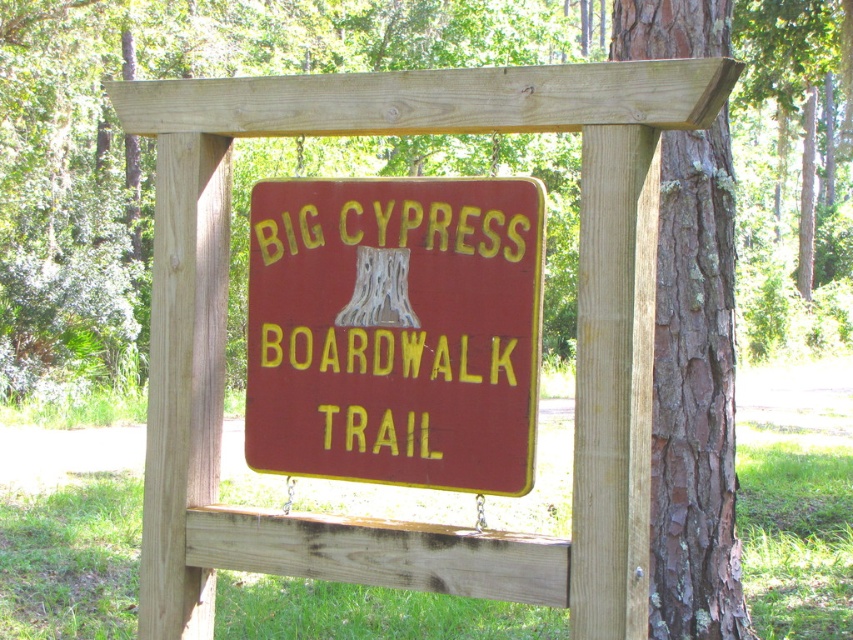
Who is positioned more to the left, brown rough bark tree at center or brown rough bark at right?

brown rough bark at right

Is point (140, 68) closer to viewer compared to point (683, 225)?

No, it is not.

You are a GUI agent. You are given a task and a screenshot of the screen. Output one action in this format:
    pyautogui.click(x=<x>, y=<y>)
    Task: Click on the brown rough bark tree at center
    
    Given the screenshot: What is the action you would take?
    pyautogui.click(x=151, y=140)

Is point (215, 33) behind point (252, 208)?

Yes.

Does brown rough bark tree at center appear over matte red sign at center?

Correct, brown rough bark tree at center is located above matte red sign at center.

Between point (140, 355) and point (447, 410), which one is positioned behind?

The point (140, 355) is behind.

The image size is (853, 640). Find the location of `brown rough bark tree at center`. brown rough bark tree at center is located at coordinates (151, 140).

Is matte red sign at center to the left of brown rough bark at right from the viewer's perspective?

Yes, matte red sign at center is to the left of brown rough bark at right.

Is point (357, 365) positioned after point (651, 19)?

No, (357, 365) is in front of (651, 19).

This screenshot has height=640, width=853. In order to click on matte red sign at center in this screenshot , I will do `click(395, 330)`.